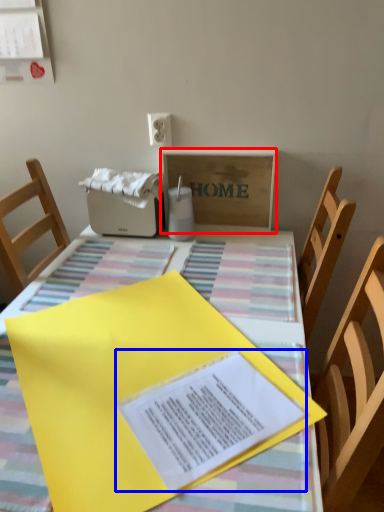
Question: Which object is closer to the camera taking this photo, cardboard box (highlighted by a red box) or journal (highlighted by a blue box)?

Choices:
 (A) cardboard box
 (B) journal

Answer: (B)